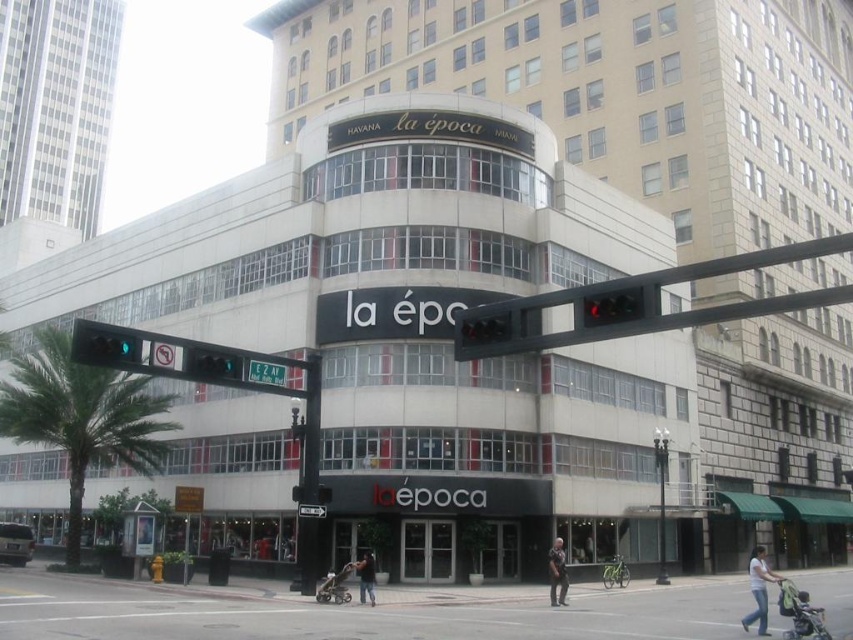
Question: Estimate the real-world distances between objects in this image. Which object is farther from the white cotton shirt at lower right?

Choices:
 (A) green glass traffic light at upper center
 (B) gray fabric baby carriage at center

Answer: (A)

Question: Which object is farther from the camera taking this photo?

Choices:
 (A) dark gray fabric stroller at lower right
 (B) dark blue jeans at center

Answer: (B)

Question: Does black metal pole at center appear on the left side of green glass traffic light at left?

Choices:
 (A) no
 (B) yes

Answer: (A)

Question: Which object appears farthest from the camera in this image?

Choices:
 (A) dark blue jeans at center
 (B) dark gray uniform at center

Answer: (B)

Question: Does black metal pole at center have a greater width compared to dark blue jeans at center?

Choices:
 (A) no
 (B) yes

Answer: (B)

Question: Can you confirm if gray fabric baby carriage at center is bigger than green metallic street sign at upper center?

Choices:
 (A) yes
 (B) no

Answer: (A)